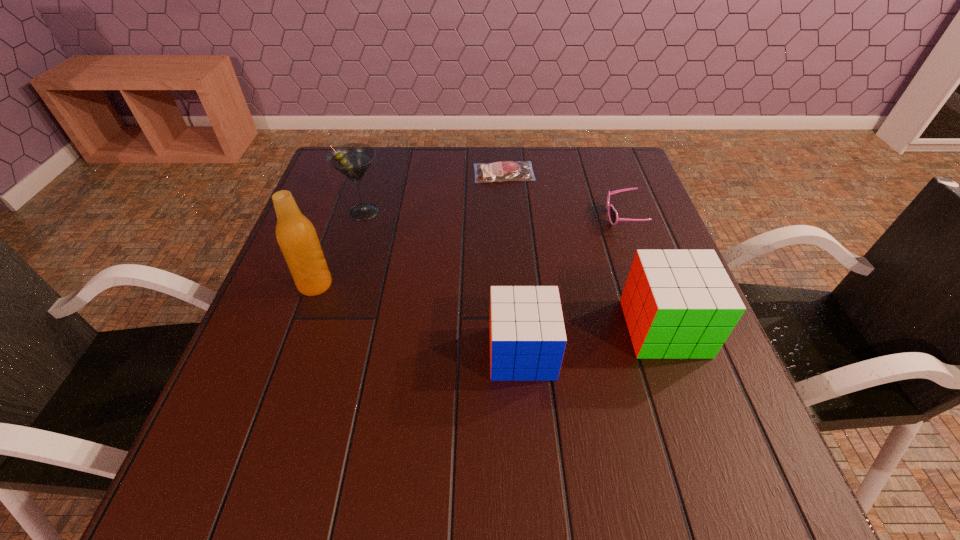
The width and height of the screenshot is (960, 540). I want to click on vacant area in the image that satisfies the following two spatial constraints: 1. on the front side of the tallest object; 2. on the right side of the third shortest object, so click(291, 353).

Find the location of a particular element. vacant area in the image that satisfies the following two spatial constraints: 1. on the front-facing side of the third tallest object; 2. on the left side of the sunglasses is located at coordinates (662, 328).